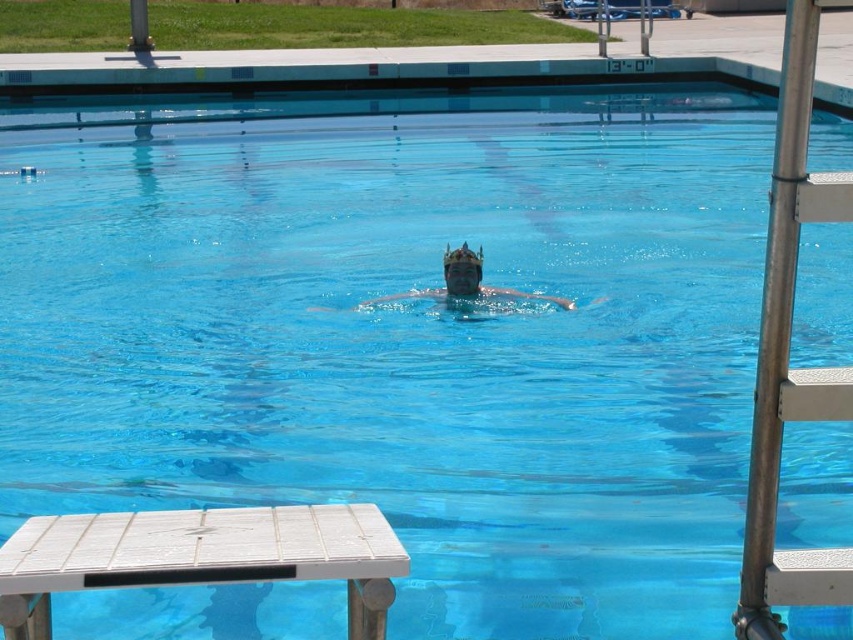
Question: In this image, where is white wood picnic table at lower left located relative to transparent plastic crown at center?

Choices:
 (A) right
 (B) left

Answer: (B)

Question: Based on their relative distances, which object is nearer to the white wood picnic table at lower left?

Choices:
 (A) transparent blue goggles at center
 (B) transparent plastic crown at center

Answer: (A)

Question: Among these objects, which one is farthest from the camera?

Choices:
 (A) white wood picnic table at lower left
 (B) transparent blue goggles at center

Answer: (B)

Question: In this image, where is white wood picnic table at lower left located relative to transparent plastic crown at center?

Choices:
 (A) right
 (B) left

Answer: (B)

Question: Does white wood picnic table at lower left appear under transparent blue goggles at center?

Choices:
 (A) yes
 (B) no

Answer: (A)

Question: Which object is positioned farthest from the white wood picnic table at lower left?

Choices:
 (A) transparent plastic crown at center
 (B) transparent blue goggles at center

Answer: (A)